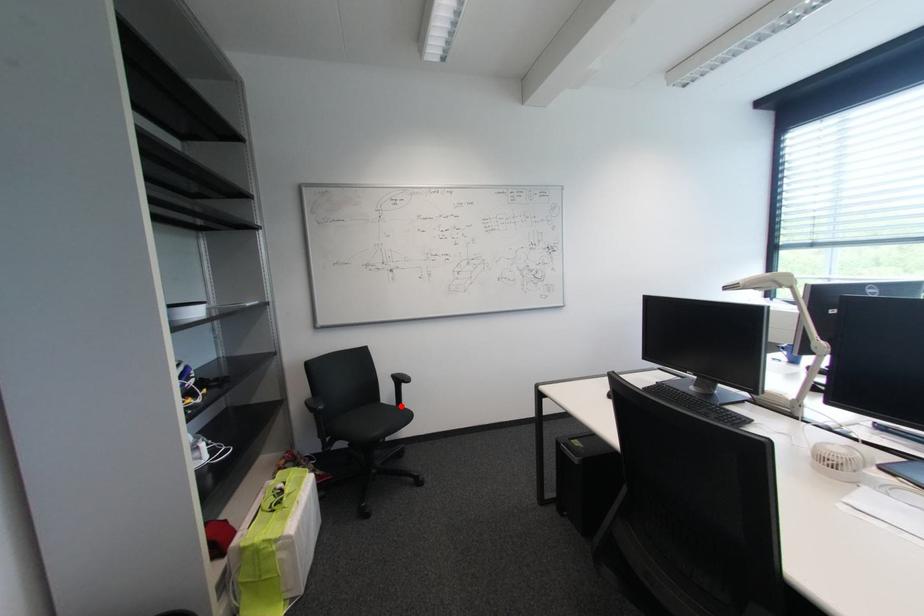
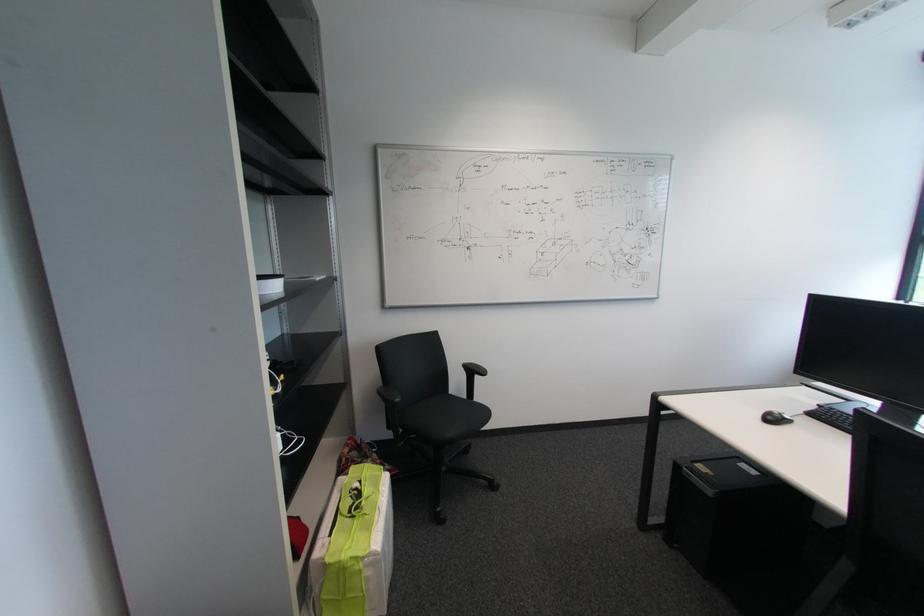
Locate, in the second image, the point that corresponds to the highlighted location in the first image.

(471, 399)